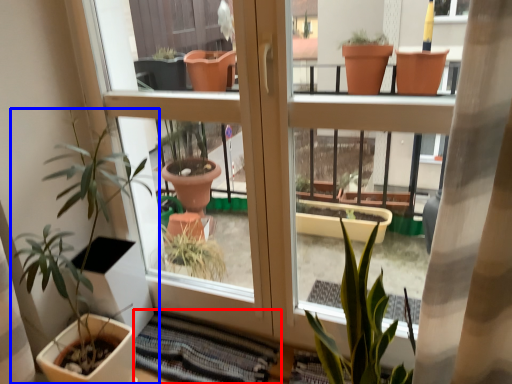
Question: Which point is closer to the camera, atrium (highlighted by a red box) or houseplant (highlighted by a blue box)?

Choices:
 (A) atrium
 (B) houseplant

Answer: (B)